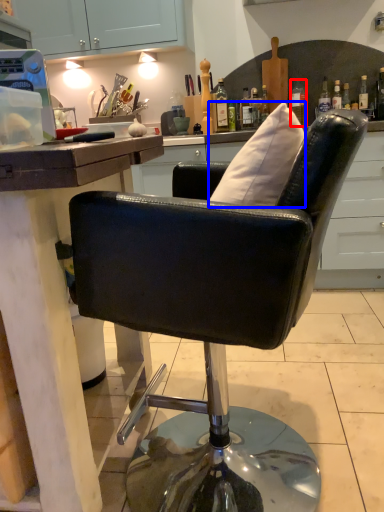
Question: Which of the following is the farthest to the observer, bottle (highlighted by a red box) or pillow (highlighted by a blue box)?

Choices:
 (A) bottle
 (B) pillow

Answer: (A)